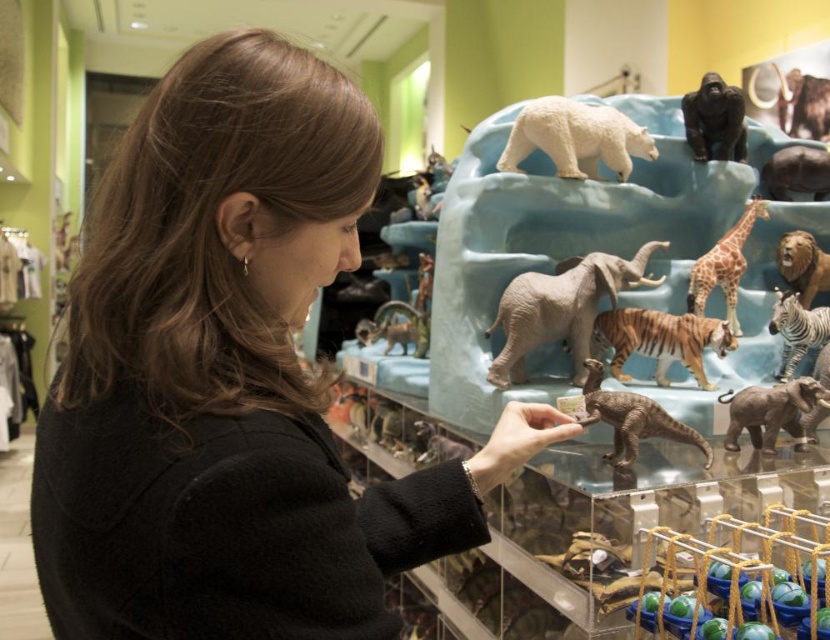
Question: Which point is farther to the camera?

Choices:
 (A) brown matte dinosaur at center
 (B) orange striped fur tiger at center
 (C) smooth brown elephant at upper right

Answer: (C)

Question: Which object is the closest to the orange striped fur tiger at center?

Choices:
 (A) black matte jacket at upper left
 (B) brown fur lion at upper right
 (C) white matte polar bear at upper center
 (D) gray matte elephant at center

Answer: (D)

Question: Is orange striped fur tiger at center to the right of white glossy zebra at right from the viewer's perspective?

Choices:
 (A) yes
 (B) no

Answer: (B)

Question: Is orange striped fur tiger at center wider than shiny black gorilla at upper right?

Choices:
 (A) no
 (B) yes

Answer: (B)

Question: Does matte brown elephant at upper center come in front of brown fur lion at upper right?

Choices:
 (A) no
 (B) yes

Answer: (A)

Question: Which of the following is the farthest from the observer?

Choices:
 (A) white glossy zebra at right
 (B) smooth brown elephant at upper right
 (C) matte brown elephant at upper center
 (D) spotted giraffe at center

Answer: (B)